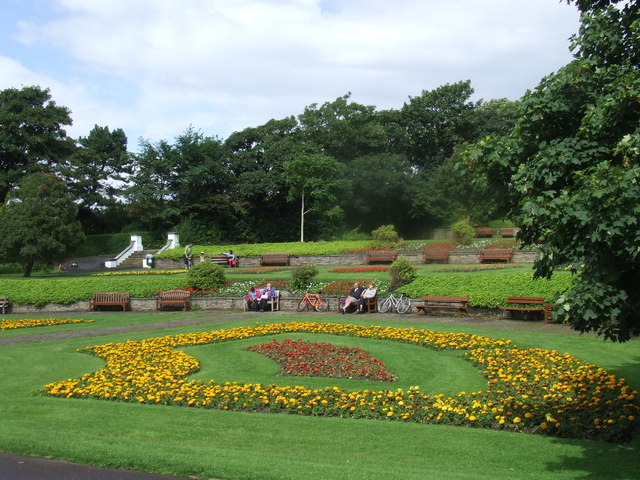
I want to click on stairs, so click(x=137, y=256).